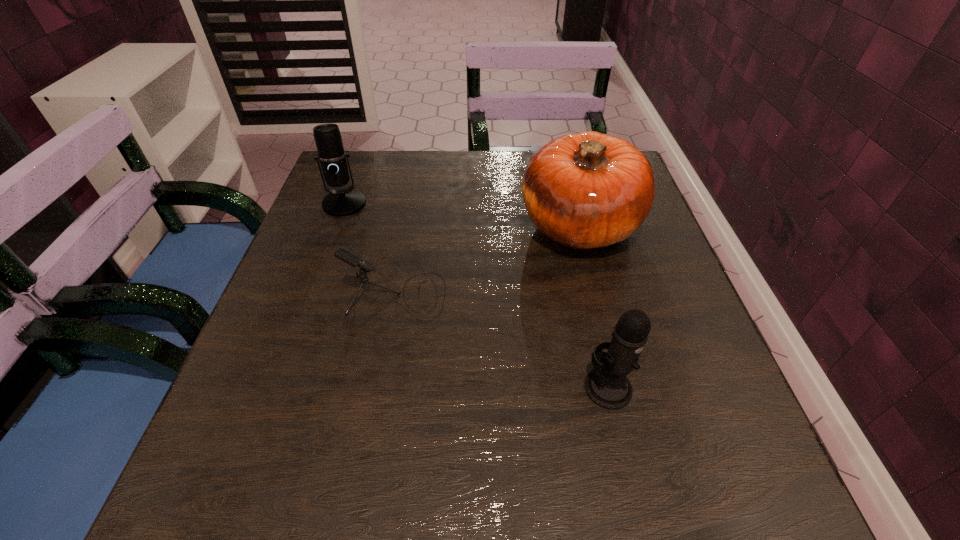
This screenshot has height=540, width=960. What are the coordinates of `vacant area in the image that satisfies the following two spatial constraints: 1. on the front side of the pumpkin; 2. on the stand of the shortest object` in the screenshot? It's located at (598, 295).

Where is `free space that satisfies the following two spatial constraints: 1. on the back side of the rightmost microphone; 2. on the left side of the pumpkin`? Image resolution: width=960 pixels, height=540 pixels. free space that satisfies the following two spatial constraints: 1. on the back side of the rightmost microphone; 2. on the left side of the pumpkin is located at coordinates (570, 226).